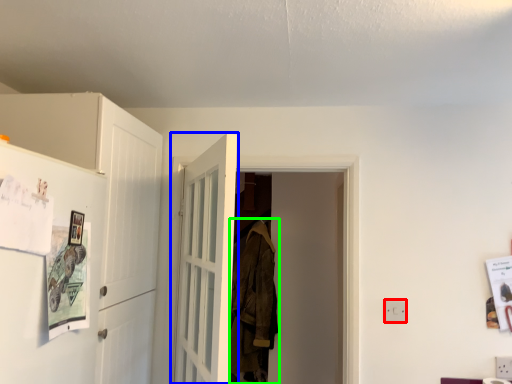
Question: Estimate the real-world distances between objects in this image. Which object is closer to electric outlet (highlighted by a red box), door (highlighted by a blue box) or laundry (highlighted by a green box)?

Choices:
 (A) door
 (B) laundry

Answer: (A)